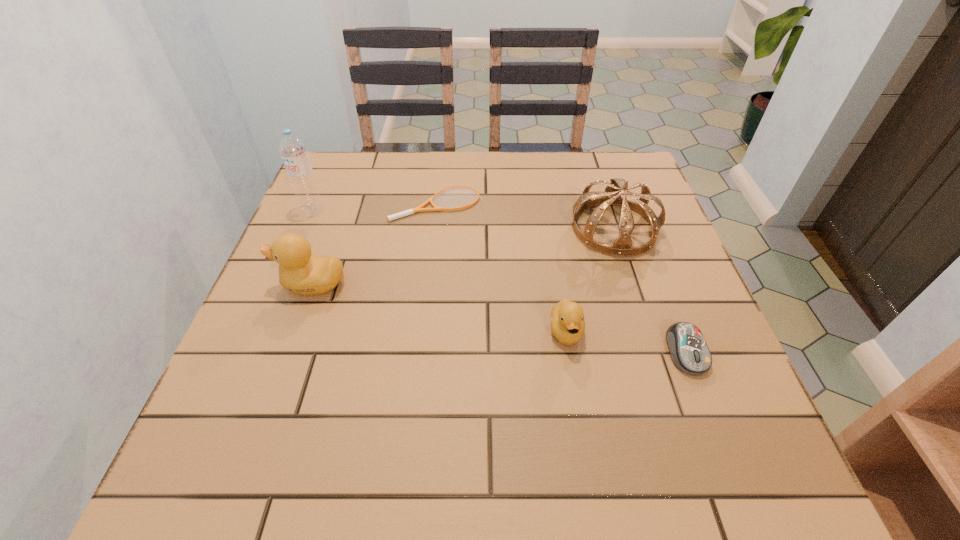
Where is `free space located on the front of the tiara`? free space located on the front of the tiara is located at coordinates (631, 281).

Locate an element on the screen. The image size is (960, 540). free location located on the back of the shortest object is located at coordinates (441, 171).

Where is `vacant region located on the front of the tallest object`? The width and height of the screenshot is (960, 540). vacant region located on the front of the tallest object is located at coordinates (257, 338).

Image resolution: width=960 pixels, height=540 pixels. I want to click on object situated at the far edge, so 420,208.

Where is `duckling at the left edge`? Image resolution: width=960 pixels, height=540 pixels. duckling at the left edge is located at coordinates (301, 272).

Find the location of a particular element. water bottle at the left edge is located at coordinates (300, 173).

Where is `tiara that is positioned at the right edge`? tiara that is positioned at the right edge is located at coordinates (621, 247).

Identify the location of computer mouse that is at the right edge. (688, 349).

In the image, there is a desktop. Where is `vacant space at the far edge`? The width and height of the screenshot is (960, 540). vacant space at the far edge is located at coordinates (390, 166).

Find the location of `vacant space at the near edge of the desktop`. vacant space at the near edge of the desktop is located at coordinates (313, 415).